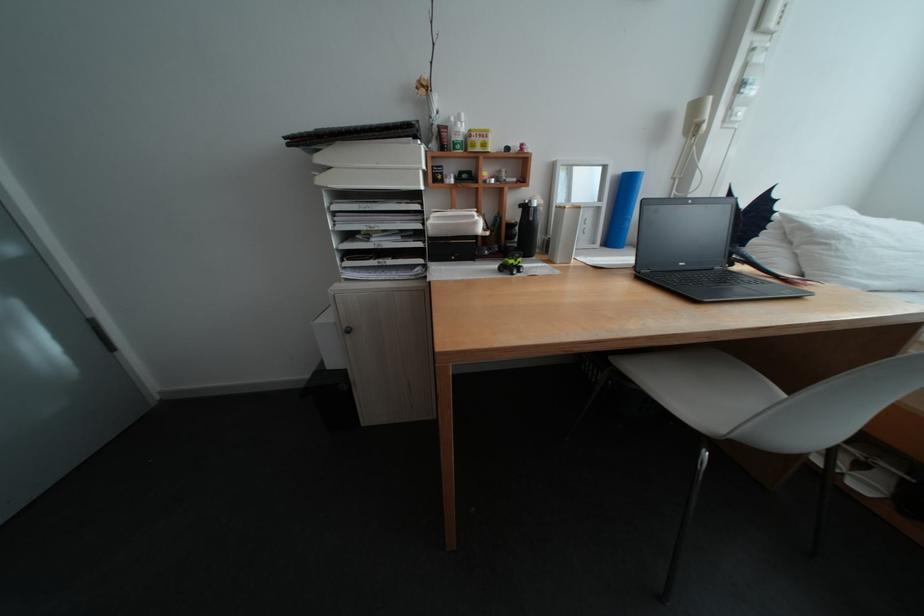
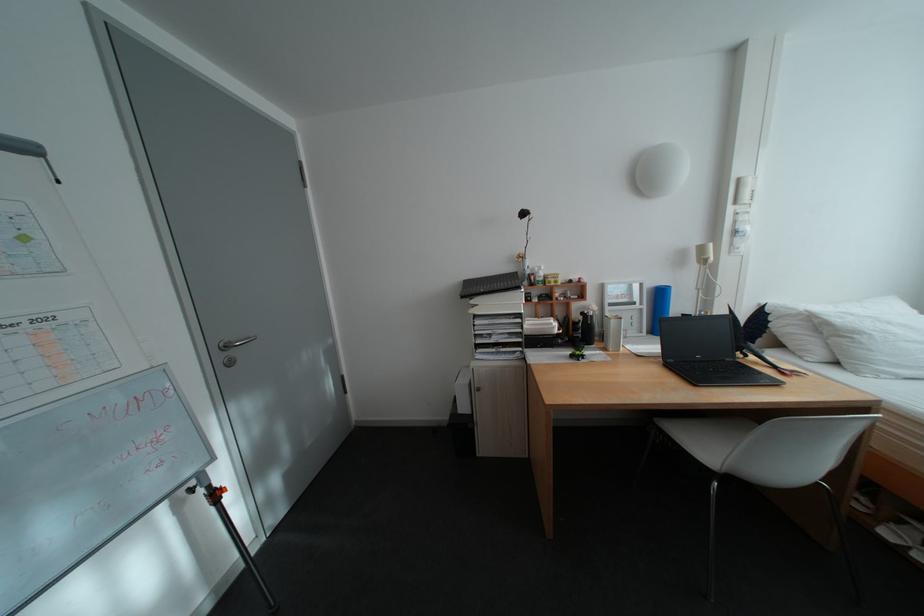
Where in the second image is the point corresponding to point (849, 240) from the first image?

(871, 334)